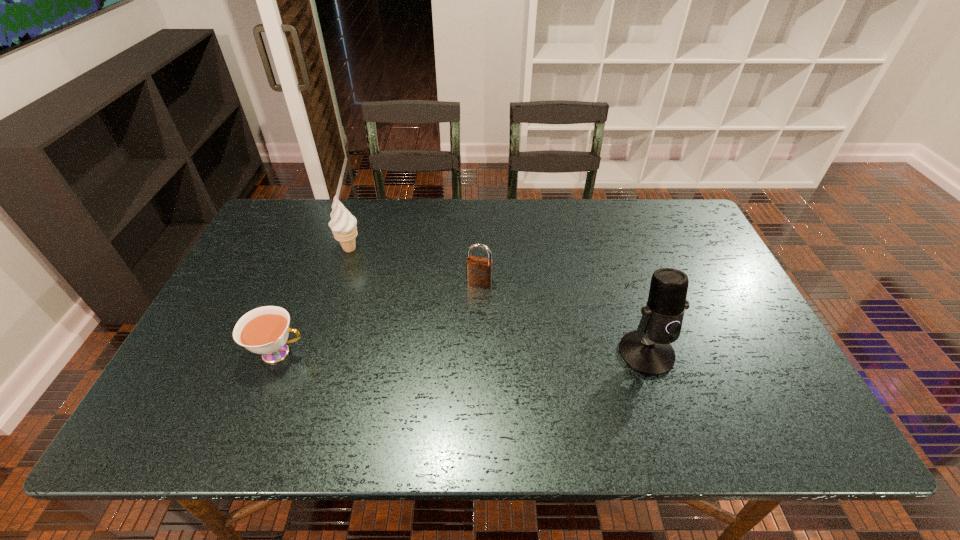
Where is `teacup`? Image resolution: width=960 pixels, height=540 pixels. teacup is located at coordinates click(x=264, y=330).

Locate an element on the screen. the rightmost object is located at coordinates (647, 350).

Identify the location of the tallest object. (647, 350).

The image size is (960, 540). I want to click on the third tallest object, so click(479, 270).

Find the location of a particular element. padlock is located at coordinates (479, 270).

The width and height of the screenshot is (960, 540). Identify the location of the farthest object. (343, 224).

Where is `the third shortest object`? This screenshot has height=540, width=960. the third shortest object is located at coordinates (343, 224).

In order to click on vacant space situated on the side of the shortest object with the handle in this screenshot , I will do `click(407, 353)`.

Where is `blank space located on the stand of the microphone`? This screenshot has width=960, height=540. blank space located on the stand of the microphone is located at coordinates (661, 400).

This screenshot has width=960, height=540. Find the location of `vacant space located 0.210m on the front-facing side of the padlock`. vacant space located 0.210m on the front-facing side of the padlock is located at coordinates (460, 346).